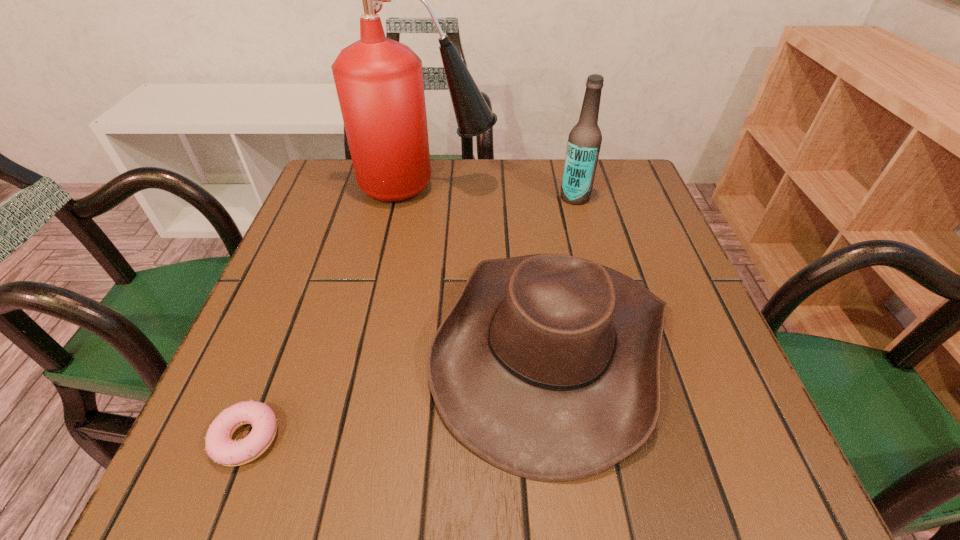
Locate an element on the screen. fire extinguisher that is at the far edge is located at coordinates (379, 82).

At what (x,y) coordinates should I click in order to perform the action: click on beer bottle present at the far edge. Please return your answer as a coordinate pair (x, y). This screenshot has height=540, width=960. Looking at the image, I should click on coord(584,142).

This screenshot has height=540, width=960. I want to click on cowboy hat at the near edge, so click(547, 366).

The image size is (960, 540). I want to click on doughnut located at the near edge, so click(x=220, y=447).

Locate an element on the screen. The width and height of the screenshot is (960, 540). fire extinguisher present at the left edge is located at coordinates (379, 82).

The height and width of the screenshot is (540, 960). I want to click on doughnut present at the left edge, so click(x=220, y=447).

Locate an element on the screen. beer bottle positioned at the right edge is located at coordinates (584, 142).

Where is `cowboy hat that is at the right edge`? The width and height of the screenshot is (960, 540). cowboy hat that is at the right edge is located at coordinates (547, 366).

Find the location of a particular element. This screenshot has width=960, height=540. object that is at the far left corner is located at coordinates (379, 82).

Where is `object that is positioned at the near left corner`? The image size is (960, 540). object that is positioned at the near left corner is located at coordinates (220, 447).